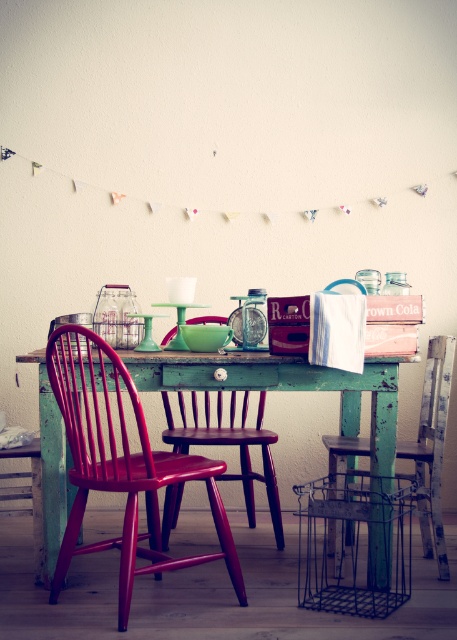
Who is shorter, green distressed wood table at center or green wood chair at center?

Standing shorter between the two is green distressed wood table at center.

Where is `green distressed wood table at center`? green distressed wood table at center is located at coordinates (285, 385).

Which is above, metallic wire basket at center or wooden chair at center?

wooden chair at center

Can you confirm if metallic wire basket at center is smaller than wooden chair at center?

Actually, metallic wire basket at center might be larger than wooden chair at center.

Which is behind, point (376, 492) or point (198, 436)?

Point (198, 436)

Image resolution: width=457 pixels, height=640 pixels. I want to click on metallic wire basket at center, so click(x=354, y=544).

Does matte red chair at center have a greater width compared to metallic wire basket at center?

Indeed, matte red chair at center has a greater width compared to metallic wire basket at center.

Which is below, matte red chair at center or metallic wire basket at center?

metallic wire basket at center is below.

Does point (191, 454) come farther from viewer compared to point (392, 556)?

Yes, point (191, 454) is farther from viewer.

Locate an element on the screen. matte red chair at center is located at coordinates (122, 465).